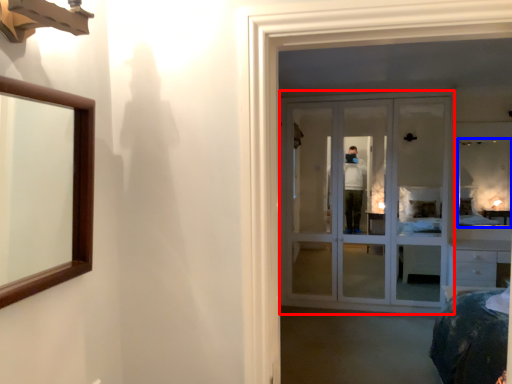
Question: Which of the following is the closest to the observer, door (highlighted by a red box) or mirror (highlighted by a blue box)?

Choices:
 (A) door
 (B) mirror

Answer: (A)